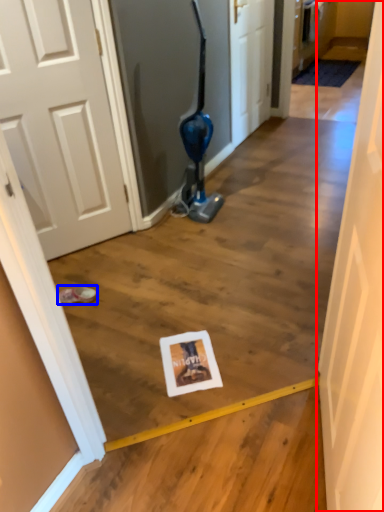
Question: Among these objects, which one is nearest to the camera, door (highlighted by a red box) or footwear (highlighted by a blue box)?

Choices:
 (A) door
 (B) footwear

Answer: (A)